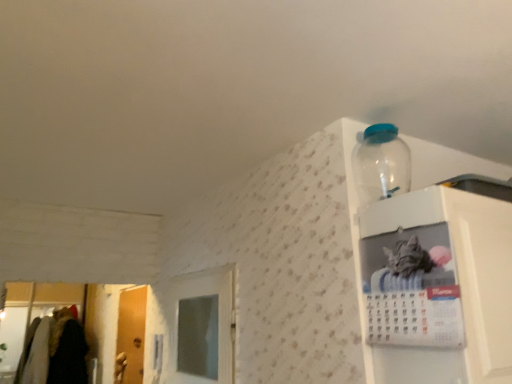
Describe the element at coordinates (131, 335) in the screenshot. I see `wooden door at left` at that location.

You are a GUI agent. You are given a task and a screenshot of the screen. Output one action in this format:
    pyautogui.click(x=<x>, y=<y>)
    Task: Click on the white glossy calendar at upper right, which is the second cabinet from left to right
    The image size is (512, 384).
    Given the screenshot: What is the action you would take?
    pyautogui.click(x=439, y=288)

Considering the relative sizes of wooden door at left and white glossy calendar at upper right, the first cabinet from the right, in the image provided, is wooden door at left bigger than white glossy calendar at upper right, the first cabinet from the right,?

No, wooden door at left is not bigger than white glossy calendar at upper right, the first cabinet from the right.

Is wooden door at left beside white glossy calendar at upper right, the first cabinet from the right?

No, wooden door at left is not beside white glossy calendar at upper right, the first cabinet from the right.

Is point (140, 337) more distant than point (446, 351)?

That is True.

Is transparent plastic bottle at upper right positioned far away from white glossy calendar at upper right, which is the second cabinet from left to right?

transparent plastic bottle at upper right is near white glossy calendar at upper right, which is the second cabinet from left to right, not far away.

Is transparent plastic bottle at upper right positioned with its back to white glossy calendar at upper right, which is the second cabinet from left to right?

No, transparent plastic bottle at upper right's orientation is not away from white glossy calendar at upper right, which is the second cabinet from left to right.

Is transparent plastic bottle at upper right taller or shorter than white glossy calendar at upper right, which is the second cabinet from left to right?

Considering their sizes, transparent plastic bottle at upper right has less height than white glossy calendar at upper right, which is the second cabinet from left to right.

Can you confirm if white glossy calendar at upper right, the first cabinet from the right, is wider than white glossy calendar at upper right, the 1th cabinet in the left-to-right sequence?

Correct, the width of white glossy calendar at upper right, the first cabinet from the right, exceeds that of white glossy calendar at upper right, the 1th cabinet in the left-to-right sequence.

Is white glossy calendar at upper right, which is the second cabinet from left to right, situated inside white glossy calendar at upper right, which is the second cabinet from right to left, or outside?

white glossy calendar at upper right, which is the second cabinet from left to right, is spatially situated outside white glossy calendar at upper right, which is the second cabinet from right to left.

Is white glossy calendar at upper right, the first cabinet from the right, at the left side of white glossy calendar at upper right, which is the second cabinet from right to left?

No, white glossy calendar at upper right, the first cabinet from the right, is not to the left of white glossy calendar at upper right, which is the second cabinet from right to left.

Which point is more distant from viewer, (484, 215) or (436, 265)?

The point (484, 215) is behind.

Is transparent plastic bottle at upper right inside white glossy calendar at upper right, which is the second cabinet from left to right?

That's incorrect, transparent plastic bottle at upper right is not inside white glossy calendar at upper right, which is the second cabinet from left to right.

From the image's perspective, which is above, white glossy calendar at upper right, the first cabinet from the right, or transparent plastic bottle at upper right?

transparent plastic bottle at upper right appears higher in the image.

Which is nearer, (511, 274) or (381, 143)?

The point (511, 274) is closer to the camera.

In order to click on cabinet lying on the right of transparent plastic bottle at upper right in this screenshot , I will do `click(439, 288)`.

Is white glossy calendar at upper right, which is the second cabinet from right to left, not near wooden door at left?

Yes.

Who is shorter, white glossy calendar at upper right, which is the second cabinet from right to left, or wooden door at left?

With less height is white glossy calendar at upper right, which is the second cabinet from right to left.

Is white glossy calendar at upper right, which is the second cabinet from right to left, turned away from wooden door at left?

No.

How many degrees apart are the facing directions of white glossy calendar at upper right, which is the second cabinet from right to left, and wooden door at left?

The angle between the facing direction of white glossy calendar at upper right, which is the second cabinet from right to left, and the facing direction of wooden door at left is 2.13 degrees.

Is white glossy calendar at upper right, the 1th cabinet in the left-to-right sequence, completely or partially outside of transparent plastic bottle at upper right?

Yes, white glossy calendar at upper right, the 1th cabinet in the left-to-right sequence, is located beyond the bounds of transparent plastic bottle at upper right.

Can you confirm if white glossy calendar at upper right, the 1th cabinet in the left-to-right sequence, is wider than transparent plastic bottle at upper right?

In fact, white glossy calendar at upper right, the 1th cabinet in the left-to-right sequence, might be narrower than transparent plastic bottle at upper right.

Between white glossy calendar at upper right, which is the second cabinet from right to left, and transparent plastic bottle at upper right, which one is positioned in front?

white glossy calendar at upper right, which is the second cabinet from right to left.

Looking at this image, from their relative heights in the image, would you say white glossy calendar at upper right, the 1th cabinet in the left-to-right sequence, is taller or shorter than transparent plastic bottle at upper right?

Clearly, white glossy calendar at upper right, the 1th cabinet in the left-to-right sequence, is taller compared to transparent plastic bottle at upper right.

Considering the sizes of objects transparent plastic bottle at upper right and white glossy calendar at upper right, the 1th cabinet in the left-to-right sequence, in the image provided, who is thinner, transparent plastic bottle at upper right or white glossy calendar at upper right, the 1th cabinet in the left-to-right sequence,?

Thinner between the two is white glossy calendar at upper right, the 1th cabinet in the left-to-right sequence.

The image size is (512, 384). In order to click on bottle located behind the white glossy calendar at upper right, which is the second cabinet from right to left in this screenshot , I will do tap(382, 164).

Does transparent plastic bottle at upper right have a larger size compared to white glossy calendar at upper right, which is the second cabinet from right to left?

Yes.

Is transparent plastic bottle at upper right facing away from white glossy calendar at upper right, the 1th cabinet in the left-to-right sequence?

No, white glossy calendar at upper right, the 1th cabinet in the left-to-right sequence, is not at the back of transparent plastic bottle at upper right.

What are the coordinates of `the 2nd cabinet in front of the wooden door at left, starting your count from the anchor` in the screenshot? It's located at (439, 288).

From a real-world perspective, which cabinet is the 2nd one underneath the transparent plastic bottle at upper right? Please provide its 2D coordinates.

[(439, 288)]

From the image, which object appears to be farther from wooden door at left, white glossy calendar at upper right, which is the second cabinet from left to right, or transparent plastic bottle at upper right?

white glossy calendar at upper right, which is the second cabinet from left to right, lies further to wooden door at left than the other object.

From the image, which object appears to be farther from transparent plastic bottle at upper right, white glossy calendar at upper right, the first cabinet from the right, or white glossy calendar at upper right, the 1th cabinet in the left-to-right sequence?

The object further to transparent plastic bottle at upper right is white glossy calendar at upper right, the 1th cabinet in the left-to-right sequence.

Based on their spatial positions, is transparent plastic bottle at upper right or white glossy calendar at upper right, the 1th cabinet in the left-to-right sequence, further from wooden door at left?

The object further to wooden door at left is white glossy calendar at upper right, the 1th cabinet in the left-to-right sequence.

Based on their spatial positions, is white glossy calendar at upper right, the 1th cabinet in the left-to-right sequence, or wooden door at left closer to white glossy calendar at upper right, which is the second cabinet from left to right?

Based on the image, white glossy calendar at upper right, the 1th cabinet in the left-to-right sequence, appears to be nearer to white glossy calendar at upper right, which is the second cabinet from left to right.

Looking at the image, which one is located closer to white glossy calendar at upper right, the first cabinet from the right, transparent plastic bottle at upper right or wooden door at left?

Among the two, transparent plastic bottle at upper right is located nearer to white glossy calendar at upper right, the first cabinet from the right.

Considering their positions, is wooden door at left positioned further to transparent plastic bottle at upper right than white glossy calendar at upper right, which is the second cabinet from left to right?

wooden door at left lies further to transparent plastic bottle at upper right than the other object.

From the image, which object appears to be farther from wooden door at left, white glossy calendar at upper right, the 1th cabinet in the left-to-right sequence, or transparent plastic bottle at upper right?

white glossy calendar at upper right, the 1th cabinet in the left-to-right sequence.

From the image, which object appears to be nearer to wooden door at left, white glossy calendar at upper right, which is the second cabinet from left to right, or white glossy calendar at upper right, the 1th cabinet in the left-to-right sequence?

Among the two, white glossy calendar at upper right, the 1th cabinet in the left-to-right sequence, is located nearer to wooden door at left.

The height and width of the screenshot is (384, 512). Identify the location of cabinet that lies between transparent plastic bottle at upper right and white glossy calendar at upper right, the first cabinet from the right, from top to bottom. (412, 290).

This screenshot has height=384, width=512. I want to click on bottle positioned between white glossy calendar at upper right, which is the second cabinet from left to right, and wooden door at left from near to far, so click(x=382, y=164).

Identify the location of cabinet positioned between white glossy calendar at upper right, which is the second cabinet from left to right, and wooden door at left from near to far. The width and height of the screenshot is (512, 384). (412, 290).

Where is `bottle between white glossy calendar at upper right, which is the second cabinet from right to left, and wooden door at left, along the z-axis`? bottle between white glossy calendar at upper right, which is the second cabinet from right to left, and wooden door at left, along the z-axis is located at coordinates (382, 164).